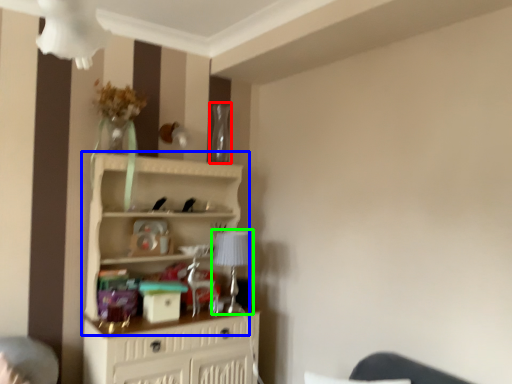
Question: Based on their relative distances, which object is nearer to glass vase (highlighted by a red box)? Choose from shelf (highlighted by a blue box) and table lamp (highlighted by a green box).

Choices:
 (A) shelf
 (B) table lamp

Answer: (A)